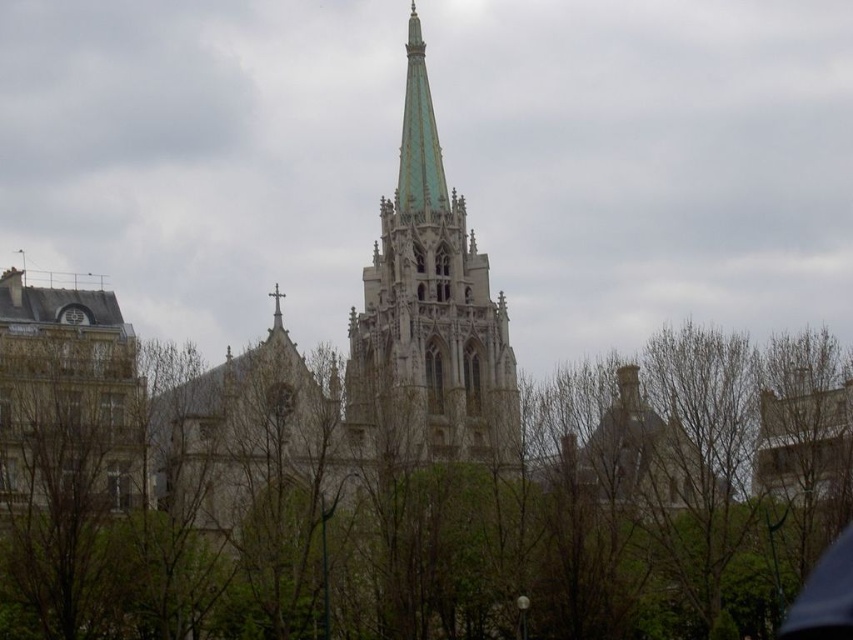
Question: Does green leafy tree at center have a smaller size compared to green stone tower at center?

Choices:
 (A) no
 (B) yes

Answer: (A)

Question: Can you confirm if green leafy tree at center is thinner than green stone tower at center?

Choices:
 (A) no
 (B) yes

Answer: (A)

Question: Which point appears closest to the camera in this image?

Choices:
 (A) (277, 410)
 (B) (456, 339)

Answer: (A)

Question: Which point is closer to the camera?

Choices:
 (A) (160, 420)
 (B) (369, 356)

Answer: (A)

Question: Is green leafy tree at center bigger than green stone tower at center?

Choices:
 (A) yes
 (B) no

Answer: (A)